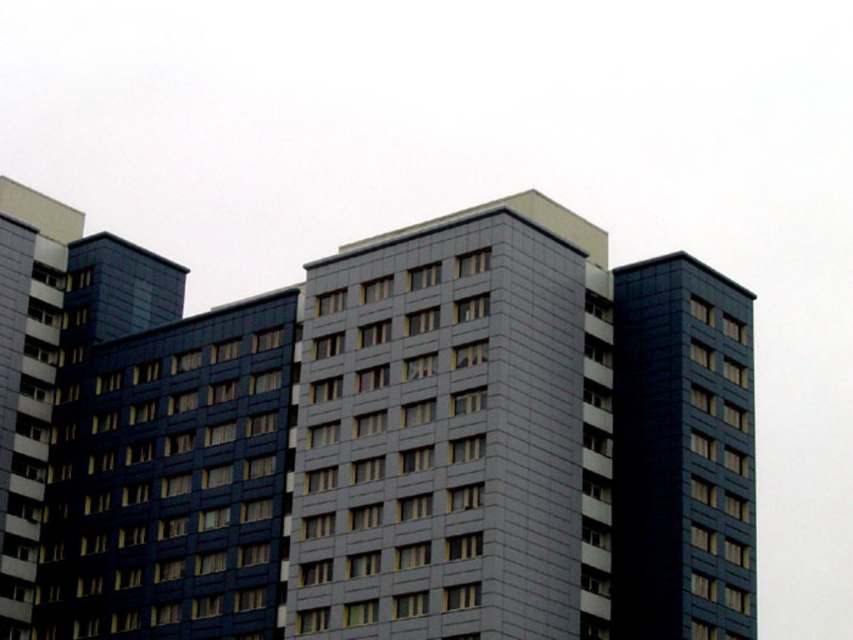
You are a city planner assessing building dimensions. Given that the slate gray concrete building at center and the matte dark blue building at right are both part of a zoning plan requiring equal width for all structures, would you need to adjust the width of either building based on their current dimensions?

The slate gray concrete building at center might be wider than matte dark blue building at right, so adjustments may be needed to ensure both buildings meet the zoning requirement of equal width.